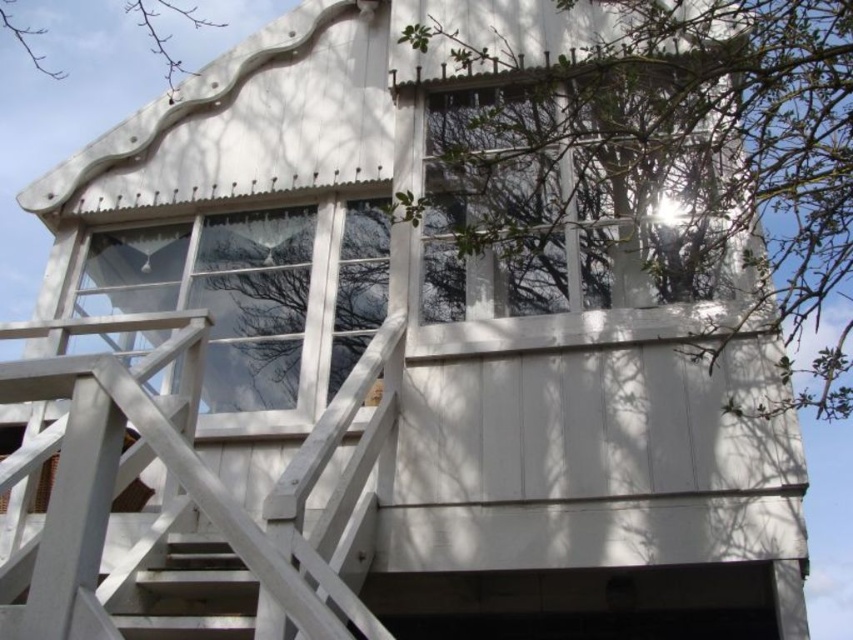
You are standing at the base of the wooden stairs leading to the white wooden structure. You notice two points marked on the railing. The first point is at coordinates point (619, 99), and the second is at point (35, 65). From your perspective, which point is closer to you?

Point (35, 65) is closer to you because it is behind point (619, 99).

Looking at this image, you are standing at the base of the stairs leading to the white wooden structure. Looking up, you notice the clear glass window at center and the green leafy tree at upper right. From your vantage point, which object is positioned to the right side?

The green leafy tree at upper right is to the right of the clear glass window at center, so the green leafy tree at upper right is positioned to the right side.